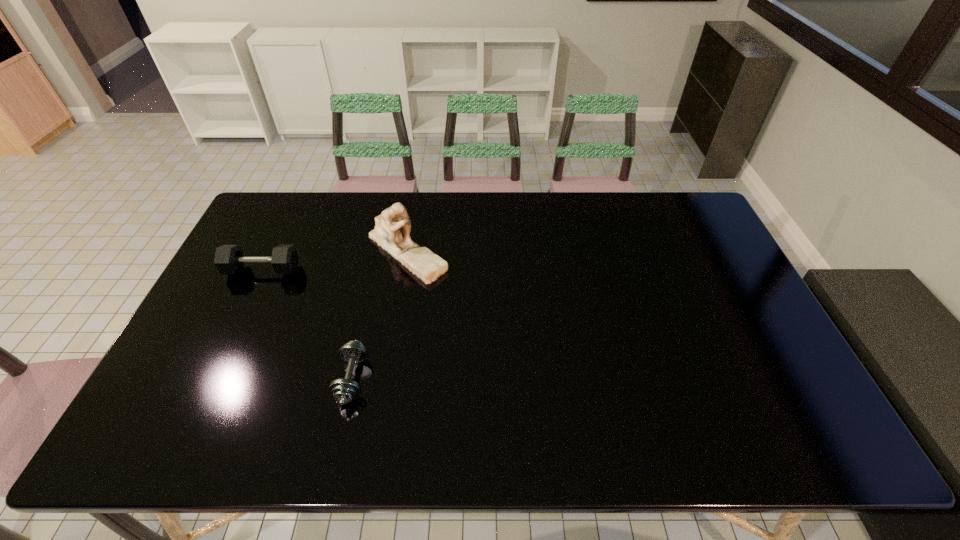
Image resolution: width=960 pixels, height=540 pixels. What are the coordinates of `blank region between the leftmost object and the tallest object` in the screenshot? It's located at (335, 261).

The image size is (960, 540). Identify the location of free area in between the tallest object and the right dumbbell. (380, 315).

You are a GUI agent. You are given a task and a screenshot of the screen. Output one action in this format:
    pyautogui.click(x=<x>, y=<y>)
    Task: Click on the free space that is in between the leftmost object and the shortest object
    Image resolution: width=960 pixels, height=540 pixels.
    Given the screenshot: What is the action you would take?
    pyautogui.click(x=307, y=325)

You are a GUI agent. You are given a task and a screenshot of the screen. Output one action in this format:
    pyautogui.click(x=<x>, y=<y>)
    Task: Click on the object that stands as the closest to the figurine
    The image size is (960, 540).
    Given the screenshot: What is the action you would take?
    pyautogui.click(x=229, y=259)

At what (x,y) coordinates should I click in order to perform the action: click on the closest object to the tallest object. Please return your answer as a coordinate pair (x, y). The width and height of the screenshot is (960, 540). Looking at the image, I should click on (229, 259).

Where is `vacant area that satisfies the following two spatial constraints: 1. on the front side of the right dumbbell; 2. on the right side of the second tallest object`? The width and height of the screenshot is (960, 540). vacant area that satisfies the following two spatial constraints: 1. on the front side of the right dumbbell; 2. on the right side of the second tallest object is located at coordinates (210, 379).

Where is `free spot that satisfies the following two spatial constraints: 1. on the front side of the second tallest object; 2. on the right side of the nearer dumbbell`? This screenshot has width=960, height=540. free spot that satisfies the following two spatial constraints: 1. on the front side of the second tallest object; 2. on the right side of the nearer dumbbell is located at coordinates (210, 379).